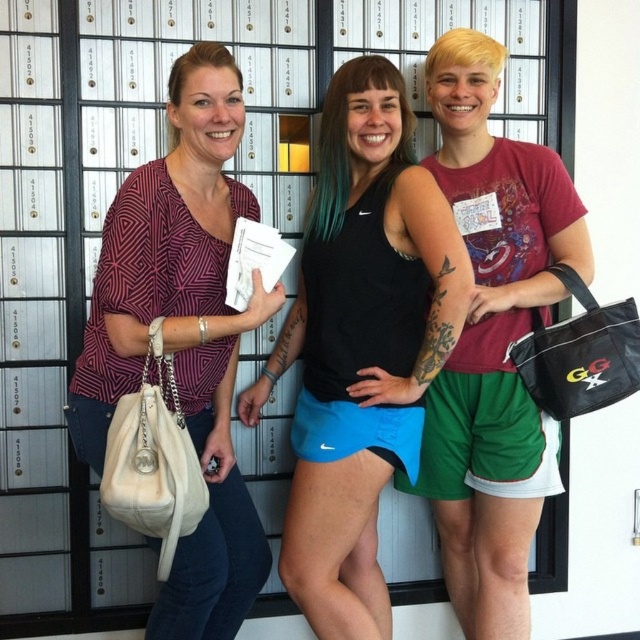
You are a photographer setting up a shot of the scene described. You need to ensure that the black matte tank top at center and the matte black purse at left are both in focus. Which object should you adjust the camera focus on first to ensure the other is also in focus?

The black matte tank top at center is below matte black purse at left, so focusing on the matte black purse at left first would ensure the black matte tank top at center is also in focus since it is closer to the camera.

You are a photographer setting up a shoot in this scene. You need to position a light source to the right of both the black matte tank top at center and the matte red shorts at center. Is this possible given their current positions?

The black matte tank top at center is positioned on the left side of matte red shorts at center, so placing a light source to the right of both would be possible as they are aligned horizontally.

You are a photographer trying to capture a closeup of the matte red shorts at center. Based on the scene description, where should you position your camera to ensure the shorts are centered in the frame?

To center the matte red shorts at center in the frame, position the camera so that the crosshairs align with the coordinates point (492, 340) provided in the scene description.